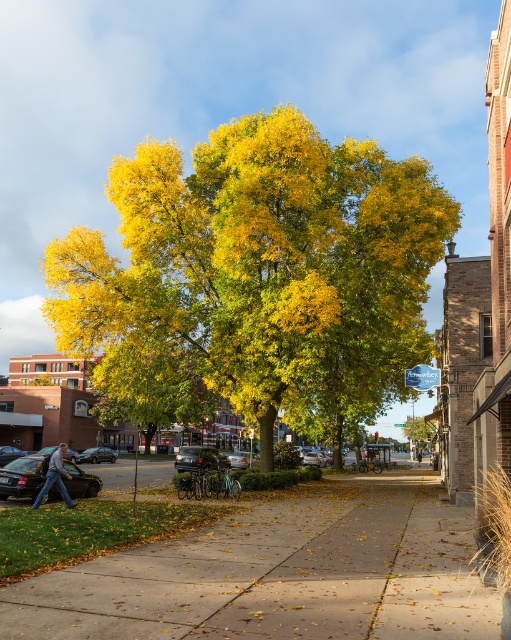
Question: Is yellow-green foliage at center bigger than concrete sidewalk at center?

Choices:
 (A) no
 (B) yes

Answer: (B)

Question: Does yellow-green foliage at center have a lesser width compared to concrete sidewalk at center?

Choices:
 (A) no
 (B) yes

Answer: (A)

Question: Which object appears closest to the camera in this image?

Choices:
 (A) yellow-green foliage at center
 (B) concrete sidewalk at center

Answer: (B)

Question: Which object appears farthest from the camera in this image?

Choices:
 (A) concrete sidewalk at center
 (B) yellow-green foliage at center

Answer: (B)

Question: Can you confirm if yellow-green foliage at center is smaller than concrete sidewalk at center?

Choices:
 (A) yes
 (B) no

Answer: (B)